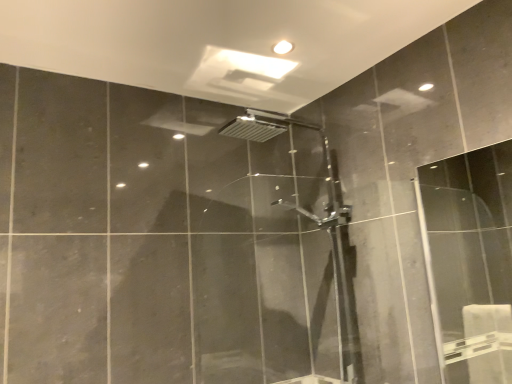
Image resolution: width=512 pixels, height=384 pixels. What do you see at coordinates (470, 261) in the screenshot?
I see `transparent glass screen door at right` at bounding box center [470, 261].

Identify the location of transparent glass screen door at right. This screenshot has width=512, height=384. (470, 261).

In order to face polished chrome shower door at center, should I rotate leftwards or rightwards?

It's best to rotate right around 5.735 degrees.

Describe the element at coordinates (315, 223) in the screenshot. I see `polished chrome shower door at center` at that location.

This screenshot has width=512, height=384. Find the location of `polished chrome shower door at center`. polished chrome shower door at center is located at coordinates (315, 223).

You are a GUI agent. You are given a task and a screenshot of the screen. Output one action in this format:
    pyautogui.click(x=<x>, y=<y>)
    Task: Click on the transparent glass screen door at right
    This screenshot has width=512, height=384.
    Given the screenshot: What is the action you would take?
    pyautogui.click(x=470, y=261)

Which is more to the right, transparent glass screen door at right or polished chrome shower door at center?

transparent glass screen door at right is more to the right.

Does transparent glass screen door at right lie behind polished chrome shower door at center?

No, it is in front of polished chrome shower door at center.

Which is behind, point (452, 307) or point (347, 289)?

The point (452, 307) is farther.

From the image's perspective, which is above, transparent glass screen door at right or polished chrome shower door at center?

transparent glass screen door at right appears higher in the image.

In the scene shown: From a real-world perspective, which object rests below the other?

In real-world perspective, transparent glass screen door at right is lower.

Which object is thinner, transparent glass screen door at right or polished chrome shower door at center?

transparent glass screen door at right.

Who is shorter, transparent glass screen door at right or polished chrome shower door at center?

Standing shorter between the two is transparent glass screen door at right.

Considering the sizes of objects transparent glass screen door at right and polished chrome shower door at center in the image provided, who is bigger, transparent glass screen door at right or polished chrome shower door at center?

polished chrome shower door at center is bigger.

Based on the photo, can we say transparent glass screen door at right lies outside polished chrome shower door at center?

transparent glass screen door at right lies outside polished chrome shower door at center's area.

Does transparent glass screen door at right touch polished chrome shower door at center?

No.

Could you tell me if transparent glass screen door at right is facing polished chrome shower door at center?

No, transparent glass screen door at right is not facing towards polished chrome shower door at center.

What's the angular difference between transparent glass screen door at right and polished chrome shower door at center's facing directions?

They differ by 1.2 degrees in their facing directions.

You are a GUI agent. You are given a task and a screenshot of the screen. Output one action in this format:
    pyautogui.click(x=<x>, y=<y>)
    Task: Click on the shower door that is below the transparent glass screen door at right (from the image's perspective)
    This screenshot has height=384, width=512.
    Given the screenshot: What is the action you would take?
    pyautogui.click(x=315, y=223)

Between polished chrome shower door at center and transparent glass screen door at right, which one appears on the right side from the viewer's perspective?

Positioned to the right is transparent glass screen door at right.

Considering the positions of objects polished chrome shower door at center and transparent glass screen door at right in the image provided, who is in front, polished chrome shower door at center or transparent glass screen door at right?

Positioned in front is transparent glass screen door at right.

Is point (334, 244) behind point (422, 234)?

Yes, point (334, 244) is farther from viewer.

From the image's perspective, which one is positioned higher, polished chrome shower door at center or transparent glass screen door at right?

transparent glass screen door at right is shown above in the image.

From a real-world perspective, is polished chrome shower door at center physically above transparent glass screen door at right?

Yes.

Between polished chrome shower door at center and transparent glass screen door at right, which one has larger width?

polished chrome shower door at center is wider.

Who is taller, polished chrome shower door at center or transparent glass screen door at right?

polished chrome shower door at center is taller.

Who is smaller, polished chrome shower door at center or transparent glass screen door at right?

transparent glass screen door at right.

Is polished chrome shower door at center spatially inside transparent glass screen door at right, or outside of it?

polished chrome shower door at center is not inside transparent glass screen door at right, it's outside.

Is polished chrome shower door at center not close to transparent glass screen door at right?

Yes.

Is polished chrome shower door at center looking in the opposite direction of transparent glass screen door at right?

No, polished chrome shower door at center is not facing the opposite direction of transparent glass screen door at right.

How different are the orientations of polished chrome shower door at center and transparent glass screen door at right in degrees?

The angular difference between polished chrome shower door at center and transparent glass screen door at right is 1.2 degrees.

Image resolution: width=512 pixels, height=384 pixels. I want to click on screen door above the polished chrome shower door at center (from the image's perspective), so click(x=470, y=261).

Image resolution: width=512 pixels, height=384 pixels. I want to click on screen door that is above the polished chrome shower door at center (from the image's perspective), so click(x=470, y=261).

At what (x,y) coordinates should I click in order to perform the action: click on shower door located below the transparent glass screen door at right (from the image's perspective). Please return your answer as a coordinate pair (x, y). This screenshot has height=384, width=512. Looking at the image, I should click on (315, 223).